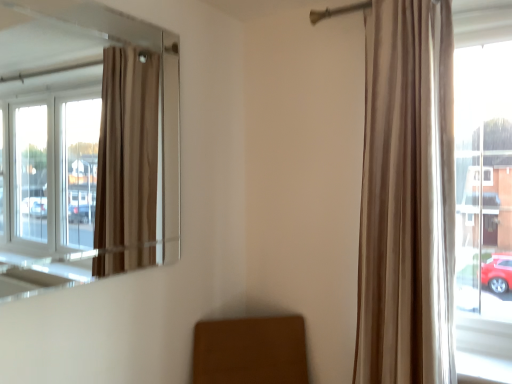
Question: From a real-world perspective, is beige velvet curtain at right physically above transparent glass window at upper left?

Choices:
 (A) yes
 (B) no

Answer: (B)

Question: Can transparent glass window at upper left be found inside beige velvet curtain at right?

Choices:
 (A) no
 (B) yes

Answer: (A)

Question: Considering the relative sizes of beige velvet curtain at right and transparent glass window at upper left in the image provided, is beige velvet curtain at right wider than transparent glass window at upper left?

Choices:
 (A) no
 (B) yes

Answer: (B)

Question: Does beige velvet curtain at right have a lesser height compared to transparent glass window at upper left?

Choices:
 (A) no
 (B) yes

Answer: (A)

Question: From a real-world perspective, does beige velvet curtain at right sit lower than transparent glass window at upper left?

Choices:
 (A) no
 (B) yes

Answer: (B)

Question: Is beige velvet curtain at right taller than transparent glass window at upper left?

Choices:
 (A) no
 (B) yes

Answer: (B)

Question: Is transparent glass window at upper left closer to the viewer compared to beige velvet curtain at right?

Choices:
 (A) yes
 (B) no

Answer: (A)

Question: Does transparent glass window at upper left have a greater height compared to beige velvet curtain at right?

Choices:
 (A) no
 (B) yes

Answer: (A)

Question: From a real-world perspective, is transparent glass window at upper left under beige velvet curtain at right?

Choices:
 (A) yes
 (B) no

Answer: (B)

Question: Is transparent glass window at upper left outside of beige velvet curtain at right?

Choices:
 (A) yes
 (B) no

Answer: (A)

Question: Considering the relative sizes of transparent glass window at upper left and beige velvet curtain at right in the image provided, is transparent glass window at upper left shorter than beige velvet curtain at right?

Choices:
 (A) no
 (B) yes

Answer: (B)

Question: Does transparent glass window at upper left have a lesser width compared to beige velvet curtain at right?

Choices:
 (A) no
 (B) yes

Answer: (B)

Question: From the image's perspective, is beige velvet curtain at right above or below transparent glass window at upper left?

Choices:
 (A) above
 (B) below

Answer: (B)